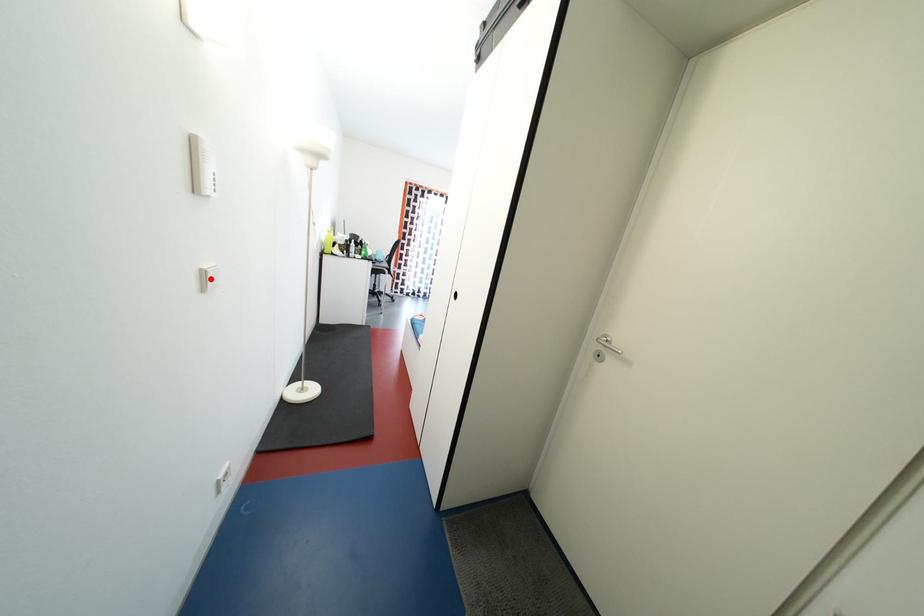
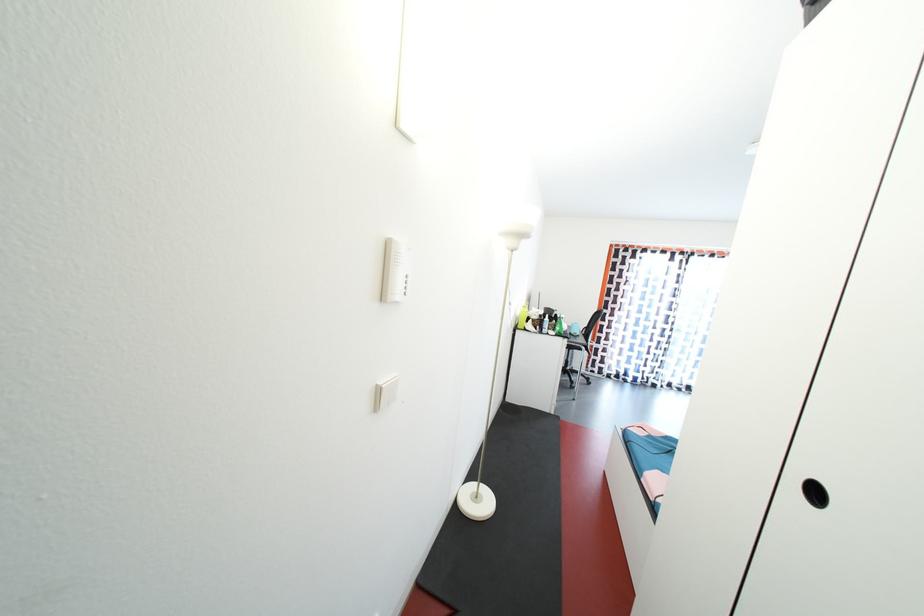
The point at the highlighted location is marked in the first image. Where is the corresponding point in the second image?

(384, 395)